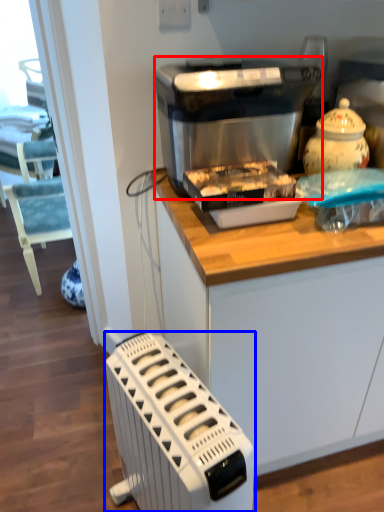
Question: Which point is further to the camera, kitchen appliance (highlighted by a red box) or home appliance (highlighted by a blue box)?

Choices:
 (A) kitchen appliance
 (B) home appliance

Answer: (A)